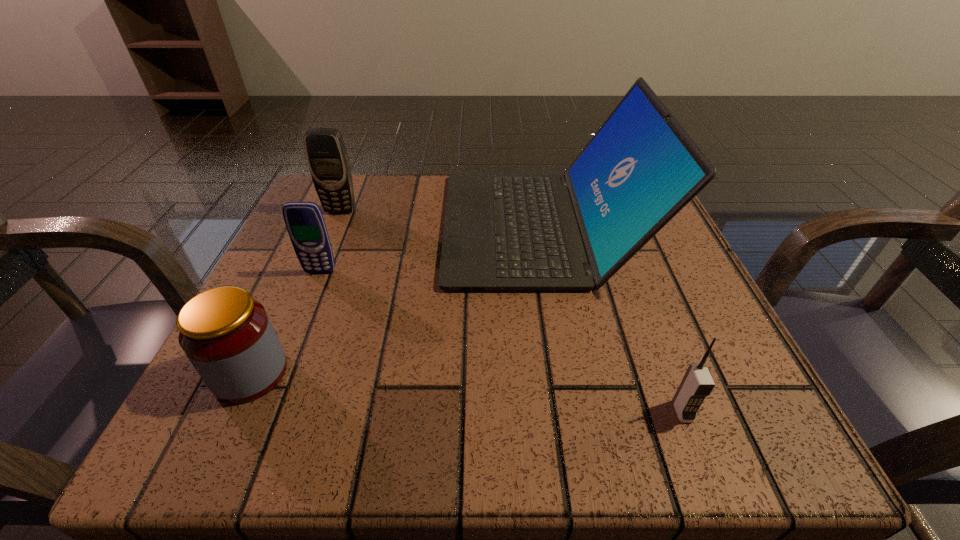
The width and height of the screenshot is (960, 540). Find the location of `object at the near left corner`. object at the near left corner is located at coordinates (227, 335).

I want to click on object positioned at the far right corner, so click(x=503, y=231).

Where is `object present at the near right corner`? The width and height of the screenshot is (960, 540). object present at the near right corner is located at coordinates (697, 383).

This screenshot has width=960, height=540. I want to click on free spot at the far edge of the desktop, so click(392, 183).

Find the location of a particular element. Image resolution: width=960 pixels, height=540 pixels. free point at the near edge is located at coordinates (332, 437).

In the image, there is a desktop. Where is `free space at the left edge`? This screenshot has height=540, width=960. free space at the left edge is located at coordinates (336, 305).

Locate an element on the screen. Image resolution: width=960 pixels, height=540 pixels. vacant space at the right edge of the desktop is located at coordinates (654, 260).

The width and height of the screenshot is (960, 540). In the image, there is a desktop. Identify the location of vacant space at the near right corner. (x=653, y=433).

Image resolution: width=960 pixels, height=540 pixels. I want to click on free space between the farthest cellular telephone and the second nearest cellular telephone, so click(330, 241).

Identify the location of free space between the second farthest cellular telephone and the tallest cellular telephone. (330, 241).